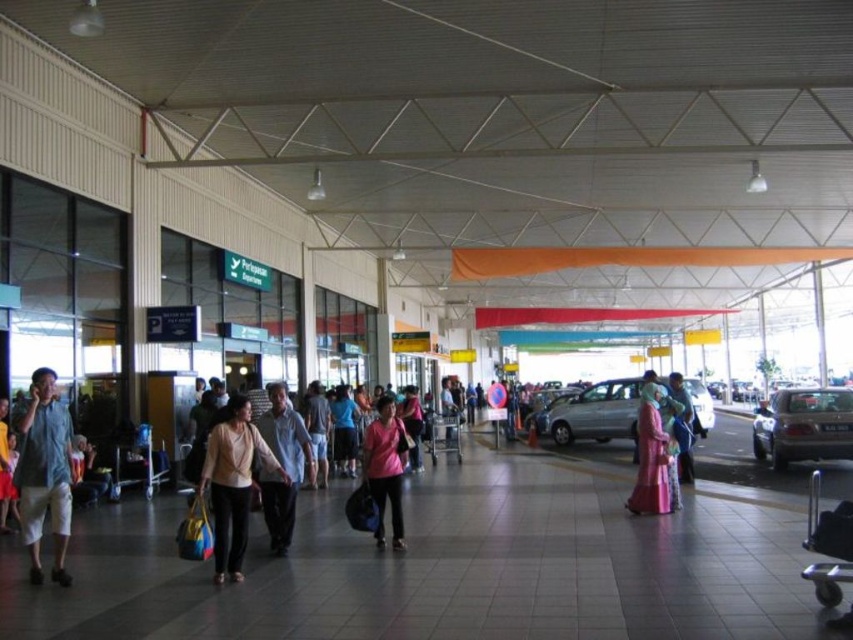
Can you confirm if silver metallic sedan at right is thinner than light blue denim shorts at center?

No, silver metallic sedan at right is not thinner than light blue denim shorts at center.

Is point (848, 406) closer to viewer compared to point (314, 452)?

No, it is behind (314, 452).

Where is `silver metallic sedan at right`? The image size is (853, 640). silver metallic sedan at right is located at coordinates (804, 426).

Is matte beige sweater at center smaller than light brown cotton shirt at center?

Correct, matte beige sweater at center occupies less space than light brown cotton shirt at center.

Which is in front, point (242, 496) or point (306, 435)?

Point (242, 496) is more forward.

Does point (216, 432) come farther from viewer compared to point (289, 508)?

No.

At what (x,y) coordinates should I click in order to perform the action: click on matte beige sweater at center. Please return your answer as a coordinate pair (x, y). The width and height of the screenshot is (853, 640). Looking at the image, I should click on (233, 481).

Does silver metallic car at center appear on the left side of pink matte shirt at center?

No, silver metallic car at center is not to the left of pink matte shirt at center.

Does silver metallic car at center appear under pink matte shirt at center?

Indeed, silver metallic car at center is positioned under pink matte shirt at center.

Locate an element on the screen. The image size is (853, 640). silver metallic car at center is located at coordinates (595, 413).

The image size is (853, 640). In order to click on silver metallic car at center in this screenshot , I will do `click(595, 413)`.